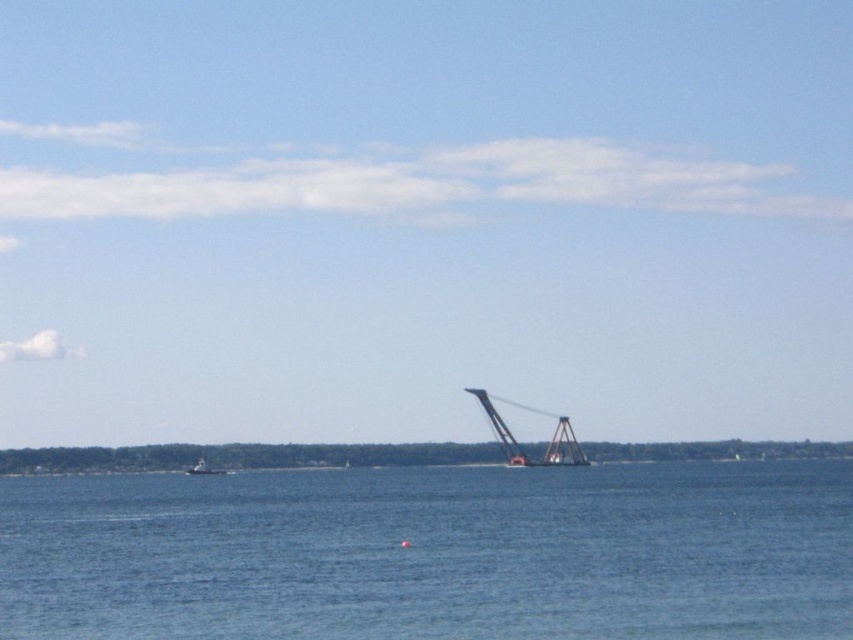
Question: Does blue water at center appear on the right side of metallic orange crane at center?

Choices:
 (A) yes
 (B) no

Answer: (B)

Question: Is metallic orange crane at center in front of white matte boat at lower left?

Choices:
 (A) yes
 (B) no

Answer: (A)

Question: Estimate the real-world distances between objects in this image. Which object is farther from the white matte boat at lower left?

Choices:
 (A) metallic orange crane at center
 (B) blue water at center

Answer: (B)

Question: Estimate the real-world distances between objects in this image. Which object is closer to the white matte boat at lower left?

Choices:
 (A) metallic orange crane at center
 (B) blue water at center

Answer: (A)

Question: Is blue water at center in front of metallic orange crane at center?

Choices:
 (A) no
 (B) yes

Answer: (B)

Question: Which object appears farthest from the camera in this image?

Choices:
 (A) blue water at center
 (B) metallic orange crane at center

Answer: (B)